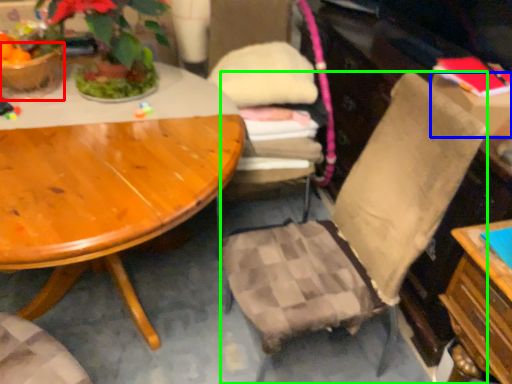
Question: Considering the real-world distances, which object is closest to flowerpot (highlighted by a red box)? box (highlighted by a blue box) or chair (highlighted by a green box).

Choices:
 (A) box
 (B) chair

Answer: (B)